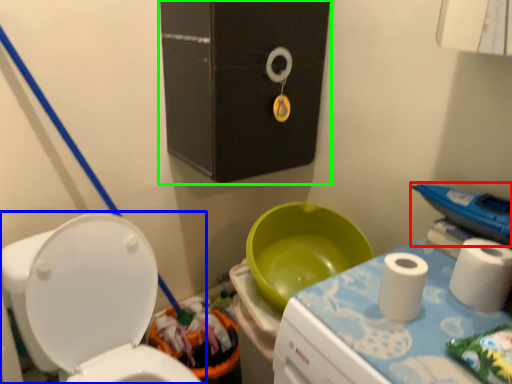
Question: Estimate the real-world distances between objects in this image. Which object is farther from appliance (highlighted by a red box), toilet (highlighted by a blue box) or medicine cabinet (highlighted by a green box)?

Choices:
 (A) toilet
 (B) medicine cabinet

Answer: (A)